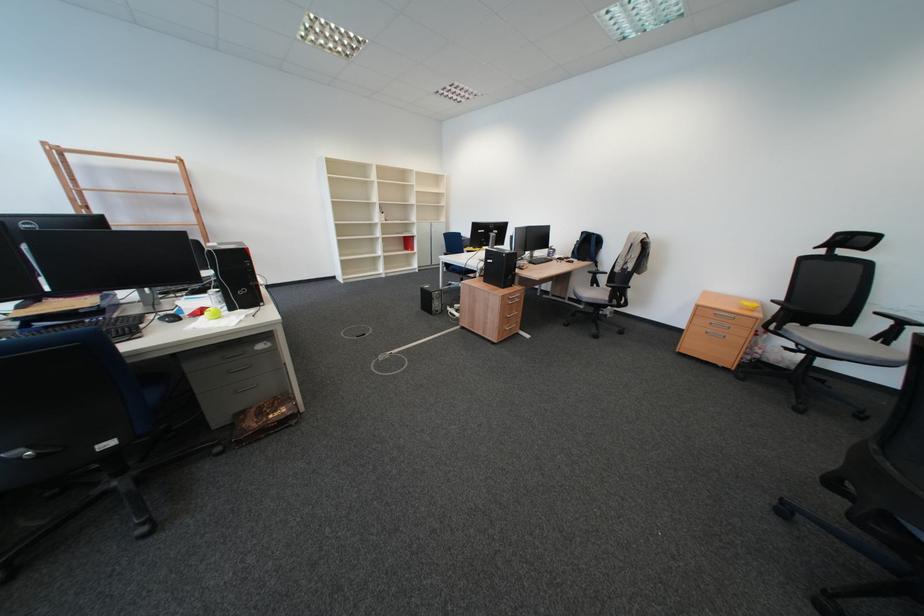
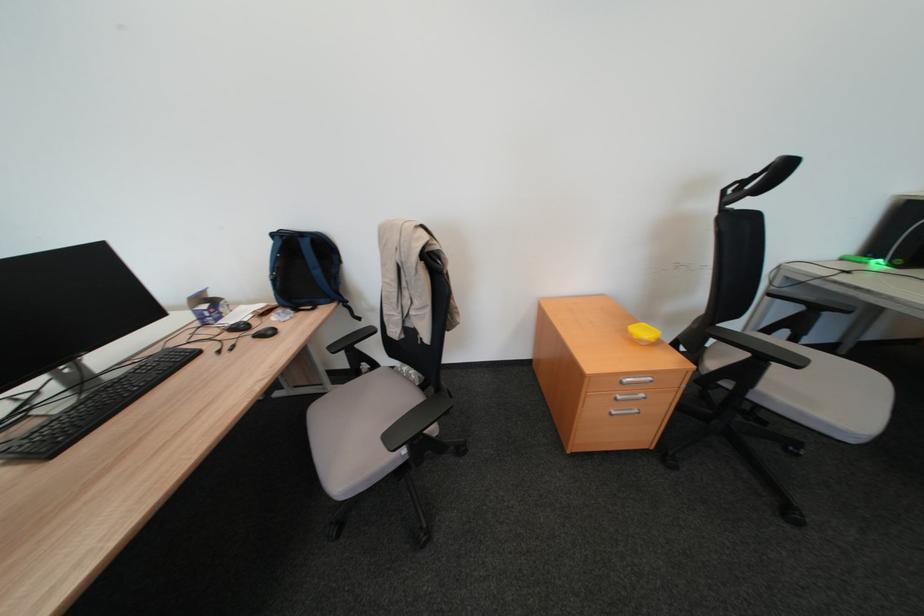
Find the pixel in the second image that matches the point at 719,334 in the first image.

(623, 416)